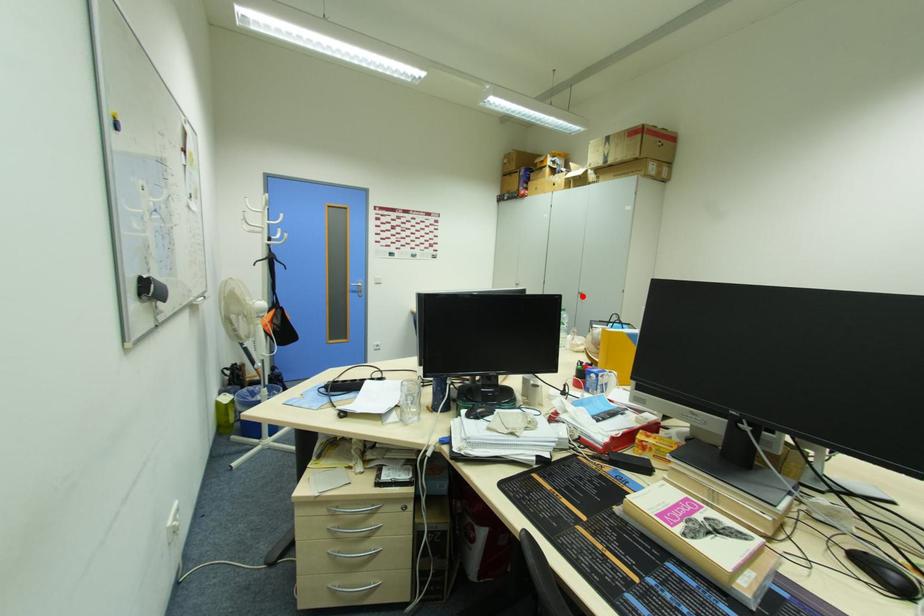
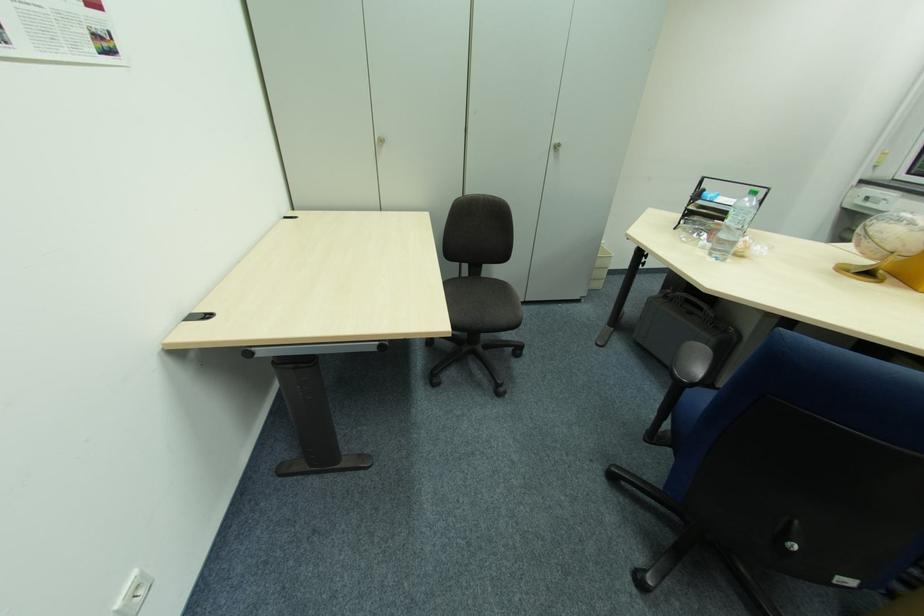
Where in the second image is the point corresponding to the highlighted location from the first image?

(554, 150)